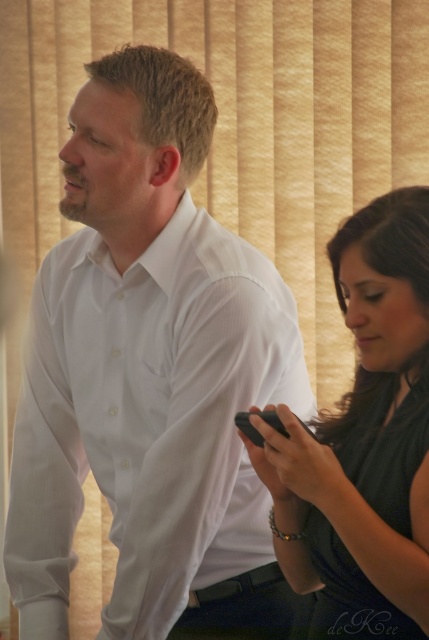
Question: Which of the following is the closest to the observer?

Choices:
 (A) (238, 243)
 (B) (272, 509)

Answer: (B)

Question: Does white smooth shirt at center have a greater width compared to black matte phone at right?

Choices:
 (A) no
 (B) yes

Answer: (B)

Question: Does white smooth shirt at center appear on the right side of black matte phone at right?

Choices:
 (A) yes
 (B) no

Answer: (B)

Question: Is white smooth shirt at center closer to camera compared to black matte phone at right?

Choices:
 (A) yes
 (B) no

Answer: (B)